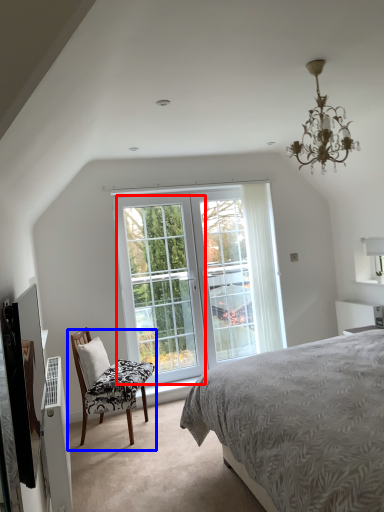
Question: Which point is further to the camera, window (highlighted by a red box) or chair (highlighted by a blue box)?

Choices:
 (A) window
 (B) chair

Answer: (A)